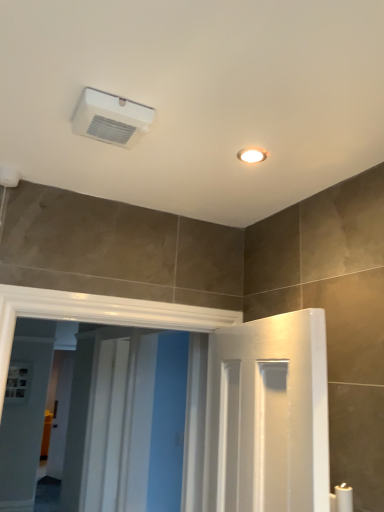
Question: From the image's perspective, is white glossy screen door at center, arranged as the 1th screen door when viewed from the back, on white glossy screen door at center, the 2th screen door in the back-to-front sequence?

Choices:
 (A) no
 (B) yes

Answer: (A)

Question: Is white glossy screen door at center, arranged as the 2th screen door when viewed from the front, oriented away from white glossy screen door at center, the 2th screen door in the back-to-front sequence?

Choices:
 (A) no
 (B) yes

Answer: (A)

Question: Can you see white glossy screen door at center, arranged as the 1th screen door when viewed from the back, touching white glossy screen door at center, which ranks as the first screen door in front-to-back order?

Choices:
 (A) no
 (B) yes

Answer: (A)

Question: From the image's perspective, is white glossy screen door at center, arranged as the 1th screen door when viewed from the back, below white glossy screen door at center, the 2th screen door in the back-to-front sequence?

Choices:
 (A) yes
 (B) no

Answer: (A)

Question: Is white glossy screen door at center, arranged as the 2th screen door when viewed from the front, at the right side of white glossy screen door at center, which ranks as the first screen door in front-to-back order?

Choices:
 (A) no
 (B) yes

Answer: (A)

Question: Is white glossy screen door at center, arranged as the 1th screen door when viewed from the back, spatially inside white glossy screen door at center, which ranks as the first screen door in front-to-back order, or outside of it?

Choices:
 (A) inside
 (B) outside

Answer: (B)

Question: From a real-world perspective, is white glossy screen door at center, arranged as the 2th screen door when viewed from the front, physically located above or below white glossy screen door at center, the 2th screen door in the back-to-front sequence?

Choices:
 (A) below
 (B) above

Answer: (A)

Question: In terms of width, does white glossy screen door at center, arranged as the 1th screen door when viewed from the back, look wider or thinner when compared to white glossy screen door at center, which ranks as the first screen door in front-to-back order?

Choices:
 (A) thin
 (B) wide

Answer: (A)

Question: In terms of height, does white glossy screen door at center, arranged as the 2th screen door when viewed from the front, look taller or shorter compared to white glossy screen door at center, which ranks as the first screen door in front-to-back order?

Choices:
 (A) short
 (B) tall

Answer: (A)

Question: Is point (86, 450) positioned closer to the camera than point (139, 130)?

Choices:
 (A) closer
 (B) farther

Answer: (B)

Question: Considering the relative positions of white glossy screen door at center, arranged as the 1th screen door when viewed from the back, and white plastic air conditioning unit at upper center in the image provided, is white glossy screen door at center, arranged as the 1th screen door when viewed from the back, to the left or to the right of white plastic air conditioning unit at upper center?

Choices:
 (A) left
 (B) right

Answer: (A)

Question: Is white glossy screen door at center, arranged as the 2th screen door when viewed from the front, bigger or smaller than white plastic air conditioning unit at upper center?

Choices:
 (A) big
 (B) small

Answer: (A)

Question: From their relative heights in the image, would you say white glossy screen door at center, arranged as the 2th screen door when viewed from the front, is taller or shorter than white plastic air conditioning unit at upper center?

Choices:
 (A) short
 (B) tall

Answer: (B)

Question: Does point (178, 431) appear closer or farther from the camera than point (99, 118)?

Choices:
 (A) farther
 (B) closer

Answer: (A)

Question: From the image's perspective, is white glossy screen door at center, which ranks as the first screen door in front-to-back order, positioned above or below white plastic air conditioning unit at upper center?

Choices:
 (A) above
 (B) below

Answer: (B)